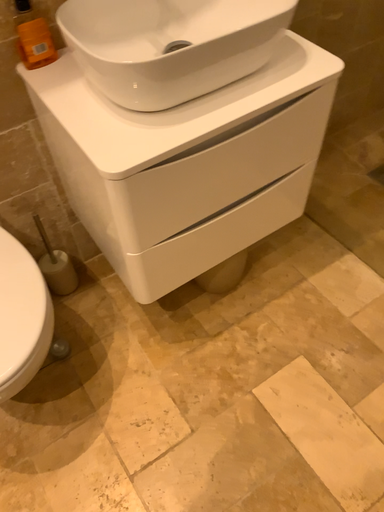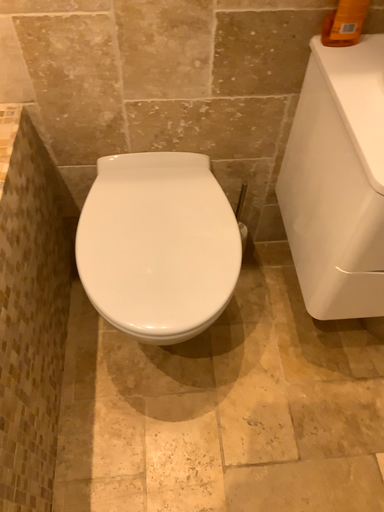
Question: How did the camera likely rotate when shooting the video?

Choices:
 (A) rotated left
 (B) rotated right

Answer: (A)